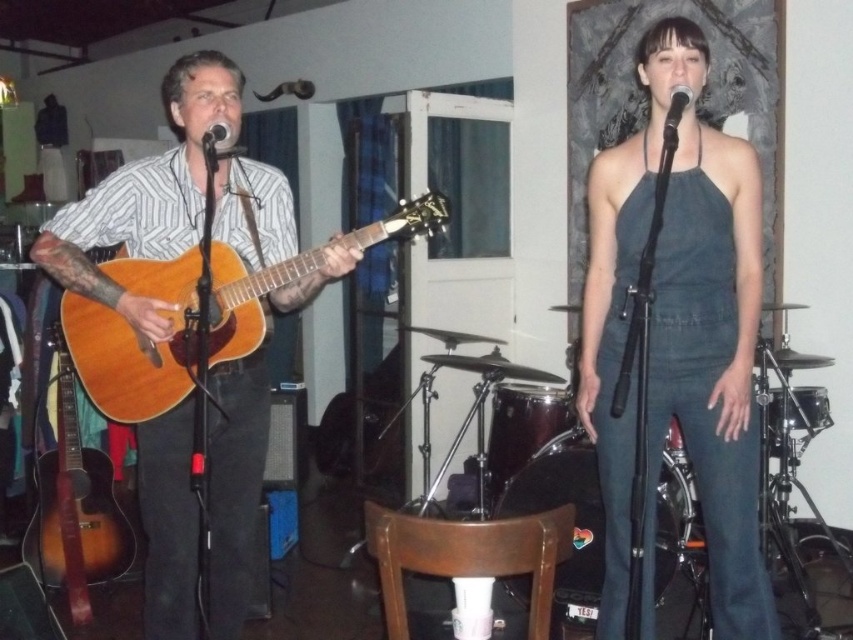
You are a photographer standing in the audience and want to take a closeup shot of the acoustic guitar. You notice two points on the guitar that you need to focus on. The first point is at coordinates point [440,212], and the second point is at coordinates point [206,141]. Which point should you focus on to ensure the guitar appears in sharp focus?

You should focus on point [440,212] because it is closer to the camera than point [206,141], ensuring the guitar is in sharp focus.

You are a photographer in the audience at the live music performance. You want to capture a photo that includes both the sunburst wood guitar at left and the black matte microphone at center. Which object should you place closer to the left edge of your camera frame to ensure both are visible?

The sunburst wood guitar at left is positioned on the left side of the black matte microphone at center, so you should place the sunburst wood guitar at left closer to the left edge of your camera frame to ensure both are visible.